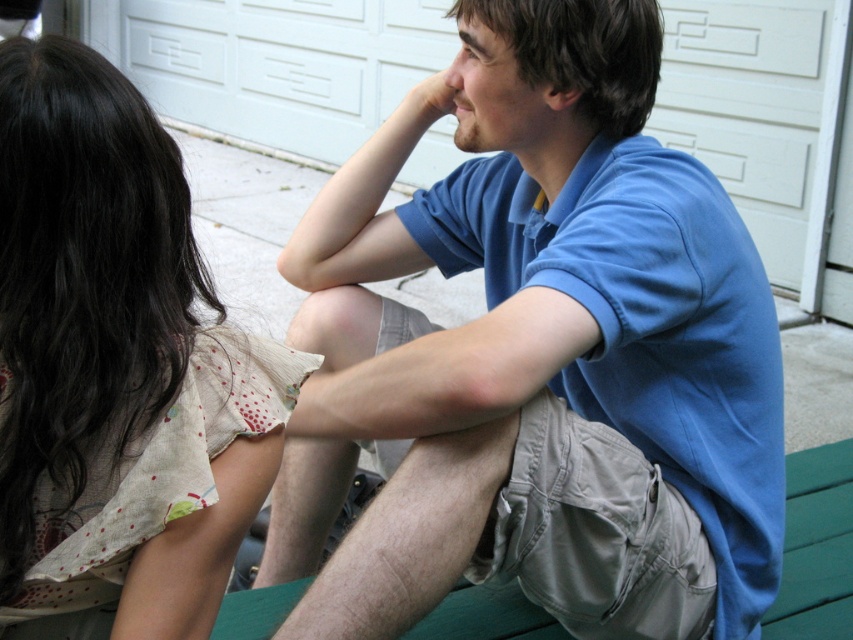
You are a photographer trying to capture a candid shot of the two people in the scene. You notice the floral cotton blouse at upper left and the matte skin hand at upper center. Which object is closer to the camera, and why?

The floral cotton blouse at upper left is closer to the camera because it is in front of the matte skin hand at upper center.

You are a photographer trying to capture a portrait of both the blue cotton shirt at center and the floral cotton blouse at upper left. Based on their heights, which one should you position closer to the camera to ensure both appear balanced in the frame?

The blue cotton shirt at center is taller than the floral cotton blouse at upper left, so you should position the floral cotton blouse at upper left closer to the camera to balance their sizes in the photograph.